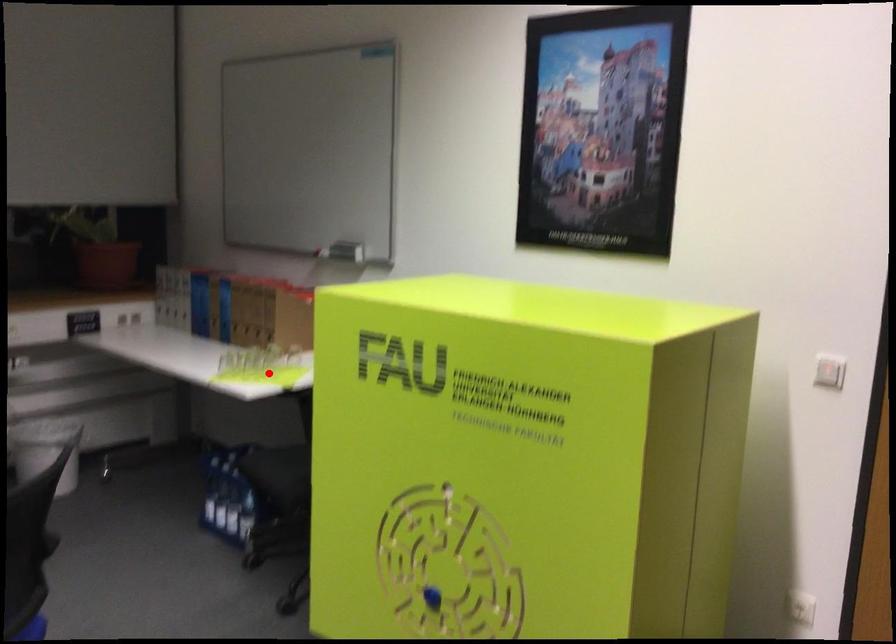
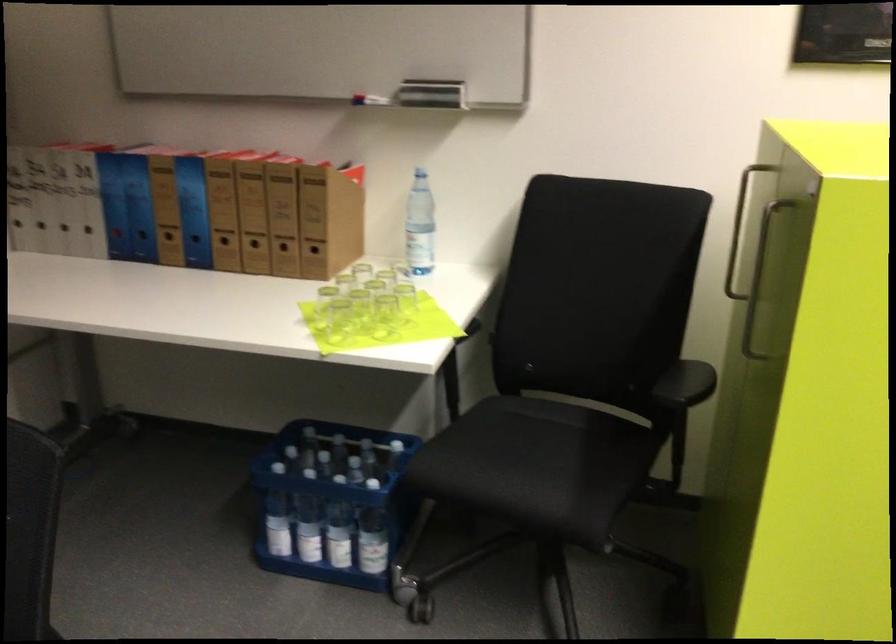
Where in the second image is the point corresponding to the highlighted location from the first image?

(383, 316)